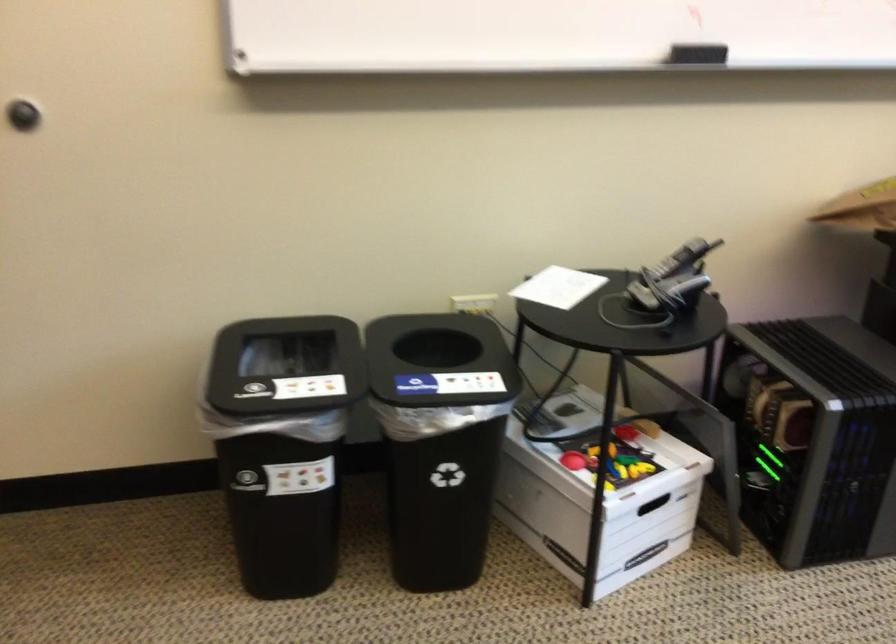
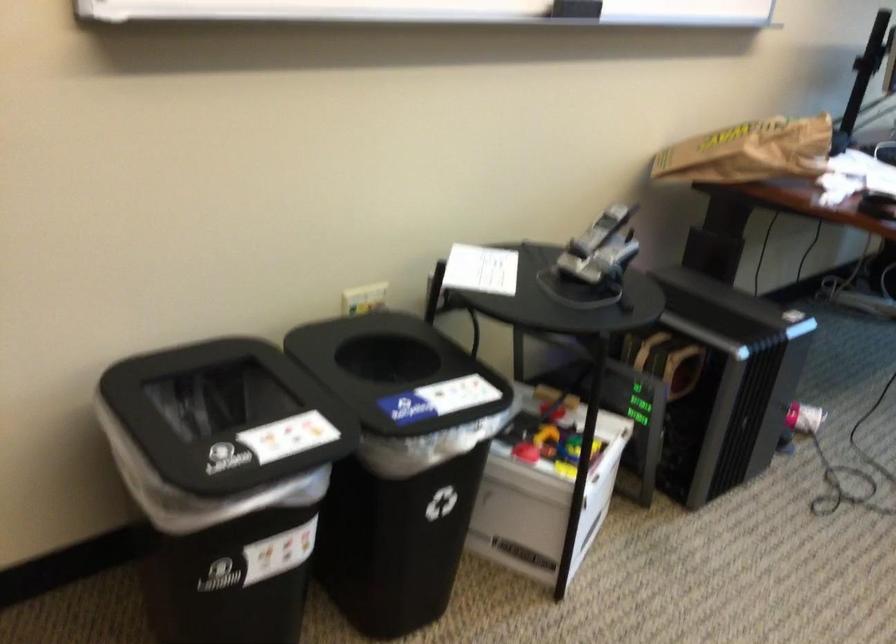
Question: How did the camera likely rotate?

Choices:
 (A) Left
 (B) Right
 (C) Up
 (D) Down

Answer: (B)